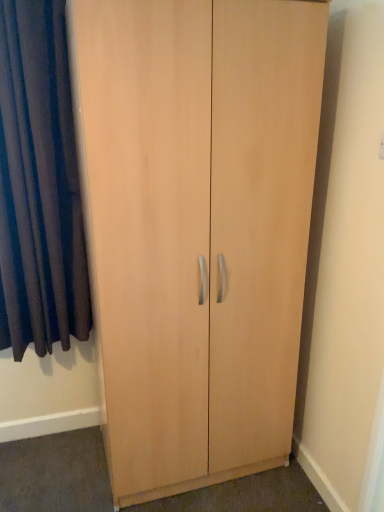
Question: Choose the correct answer: Is dark blue velvet curtain at left inside light wood cupboard at center or outside it?

Choices:
 (A) outside
 (B) inside

Answer: (A)

Question: In the image, is dark blue velvet curtain at left on the left side or the right side of light wood cupboard at center?

Choices:
 (A) left
 (B) right

Answer: (A)

Question: From the image's perspective, is dark blue velvet curtain at left positioned above or below light wood cupboard at center?

Choices:
 (A) above
 (B) below

Answer: (A)

Question: From the image's perspective, is light wood cupboard at center above or below dark blue velvet curtain at left?

Choices:
 (A) below
 (B) above

Answer: (A)

Question: From a real-world perspective, is light wood cupboard at center physically located above or below dark blue velvet curtain at left?

Choices:
 (A) below
 (B) above

Answer: (A)

Question: Looking at their shapes, would you say light wood cupboard at center is wider or thinner than dark blue velvet curtain at left?

Choices:
 (A) thin
 (B) wide

Answer: (B)

Question: Is point (94, 187) closer or farther from the camera than point (54, 91)?

Choices:
 (A) farther
 (B) closer

Answer: (B)